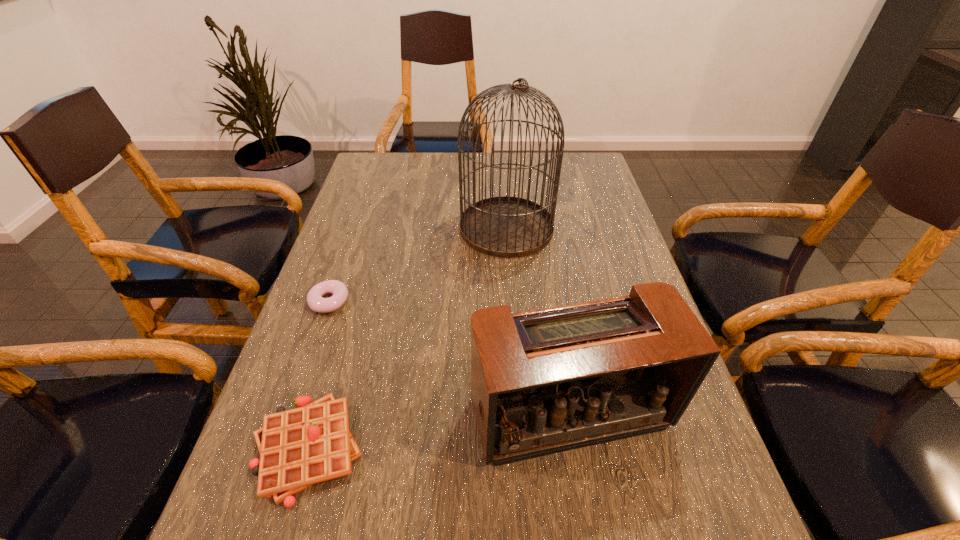
The width and height of the screenshot is (960, 540). What are the coordinates of `waffle situated at the left edge` in the screenshot? It's located at (299, 447).

You are a GUI agent. You are given a task and a screenshot of the screen. Output one action in this format:
    pyautogui.click(x=<x>, y=<y>)
    Task: Click on the doughnut present at the left edge
    The width and height of the screenshot is (960, 540).
    Given the screenshot: What is the action you would take?
    pyautogui.click(x=316, y=302)

At what (x,y) coordinates should I click in order to perform the action: click on object that is positioned at the right edge. Please return your answer as a coordinate pair (x, y). The height and width of the screenshot is (540, 960). Looking at the image, I should click on (546, 381).

I want to click on free space at the left edge, so click(x=355, y=251).

The height and width of the screenshot is (540, 960). What are the coordinates of `blank space at the right edge` in the screenshot? It's located at (579, 199).

The image size is (960, 540). Find the location of `free space at the far left corner of the desktop`. free space at the far left corner of the desktop is located at coordinates (384, 155).

In the image, there is a desktop. What are the coordinates of `free space at the far right corner` in the screenshot? It's located at (604, 178).

Identify the location of free space between the waffle and the third nearest object. (319, 375).

Where is `free point between the doughnut and the waffle`? The image size is (960, 540). free point between the doughnut and the waffle is located at coordinates (319, 375).

Identify the location of free spot between the third shortest object and the waffle. The width and height of the screenshot is (960, 540). (439, 430).